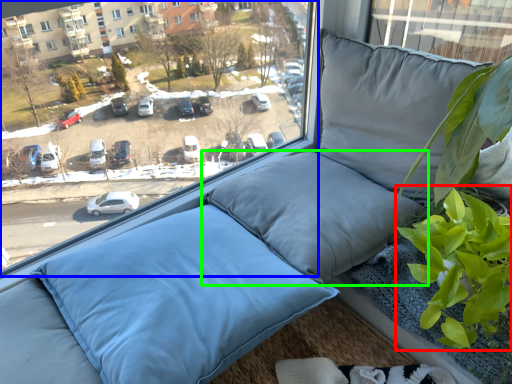
Question: Considering the real-world distances, which object is farthest from vegetation (highlighted by a red box)? window (highlighted by a blue box) or pillow (highlighted by a green box)?

Choices:
 (A) window
 (B) pillow

Answer: (A)